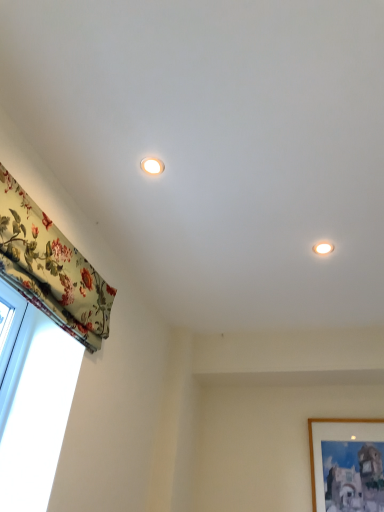
Question: Can you confirm if floral fabric curtain at left is taller than matte white light fixture at upper center, the second lighting positioned from the right?

Choices:
 (A) yes
 (B) no

Answer: (A)

Question: Can we say floral fabric curtain at left lies outside matte white light fixture at upper center, the second lighting positioned from the right?

Choices:
 (A) yes
 (B) no

Answer: (A)

Question: Considering the relative positions of floral fabric curtain at left and matte white light fixture at upper center, the 1th lighting viewed from the top, in the image provided, is floral fabric curtain at left in front of matte white light fixture at upper center, the 1th lighting viewed from the top,?

Choices:
 (A) no
 (B) yes

Answer: (B)

Question: From a real-world perspective, is floral fabric curtain at left on top of matte white light fixture at upper center, the 1th lighting viewed from the front?

Choices:
 (A) no
 (B) yes

Answer: (A)

Question: Considering the relative sizes of floral fabric curtain at left and matte white light fixture at upper center, the 1th lighting viewed from the front, in the image provided, is floral fabric curtain at left thinner than matte white light fixture at upper center, the 1th lighting viewed from the front,?

Choices:
 (A) yes
 (B) no

Answer: (A)

Question: From the image's perspective, is floral fabric curtain at left located above matte white light fixture at upper center, marked as the 2th lighting in a back-to-front arrangement?

Choices:
 (A) no
 (B) yes

Answer: (A)

Question: From a real-world perspective, is matte white light fixture at upper right, placed as the 1th lighting when sorted from back to front, physically below wooden picture frame at lower right?

Choices:
 (A) no
 (B) yes

Answer: (A)

Question: Can you confirm if matte white light fixture at upper right, the second lighting positioned from the left, is taller than wooden picture frame at lower right?

Choices:
 (A) yes
 (B) no

Answer: (B)

Question: Does matte white light fixture at upper right, the 1th lighting in the right-to-left sequence, contain wooden picture frame at lower right?

Choices:
 (A) yes
 (B) no

Answer: (B)

Question: Considering the relative sizes of matte white light fixture at upper right, which ranks as the 1th lighting in bottom-to-top order, and wooden picture frame at lower right in the image provided, is matte white light fixture at upper right, which ranks as the 1th lighting in bottom-to-top order, bigger than wooden picture frame at lower right?

Choices:
 (A) yes
 (B) no

Answer: (B)

Question: Can we say matte white light fixture at upper right, which ranks as the 1th lighting in bottom-to-top order, lies outside wooden picture frame at lower right?

Choices:
 (A) no
 (B) yes

Answer: (B)

Question: Does matte white light fixture at upper right, which ranks as the 1th lighting in bottom-to-top order, lie in front of wooden picture frame at lower right?

Choices:
 (A) no
 (B) yes

Answer: (B)

Question: Is matte white light fixture at upper right, which ranks as the 1th lighting in bottom-to-top order, positioned with its back to matte white light fixture at upper center, which is counted as the 2th lighting, starting from the bottom?

Choices:
 (A) no
 (B) yes

Answer: (A)